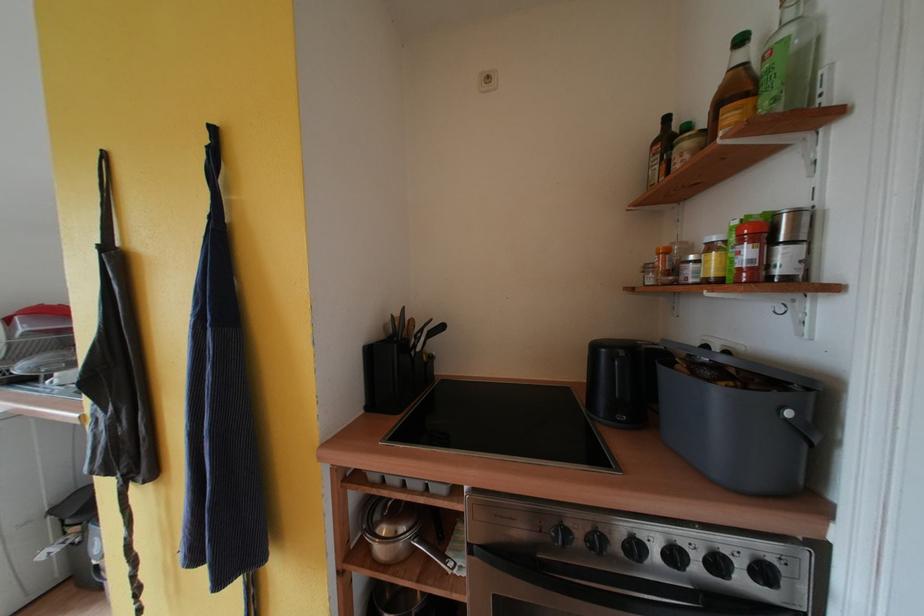
At what (x,y) coordinates should I click in order to perform the action: click on grey bin handle. Please return your answer as a coordinate pair (x, y). The height and width of the screenshot is (616, 924). Looking at the image, I should click on (806, 428).